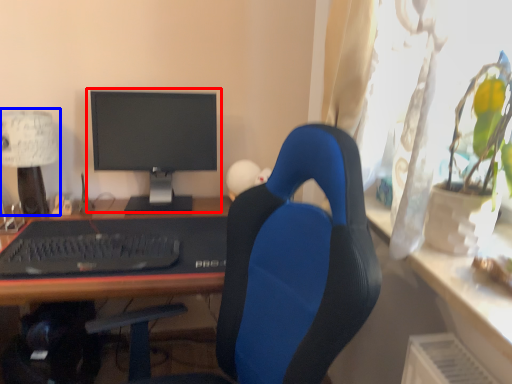
Question: Which object appears farthest to the camera in this image, computer monitor (highlighted by a red box) or table lamp (highlighted by a blue box)?

Choices:
 (A) computer monitor
 (B) table lamp

Answer: (A)